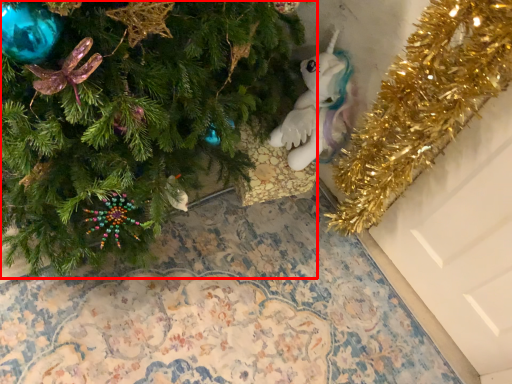
Question: From the image's perspective, where is christmas tree (annotated by the red box) located relative to toy?

Choices:
 (A) below
 (B) above

Answer: (A)